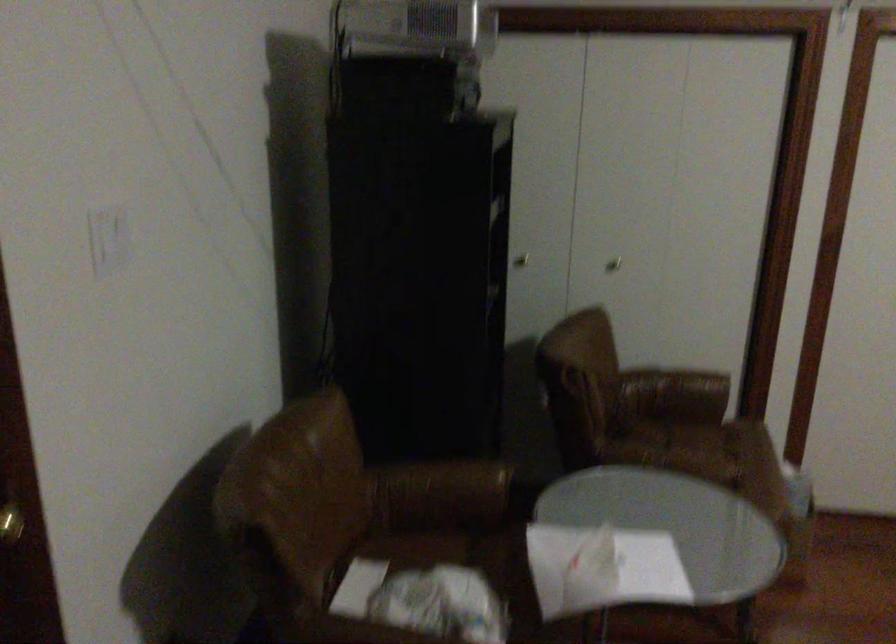
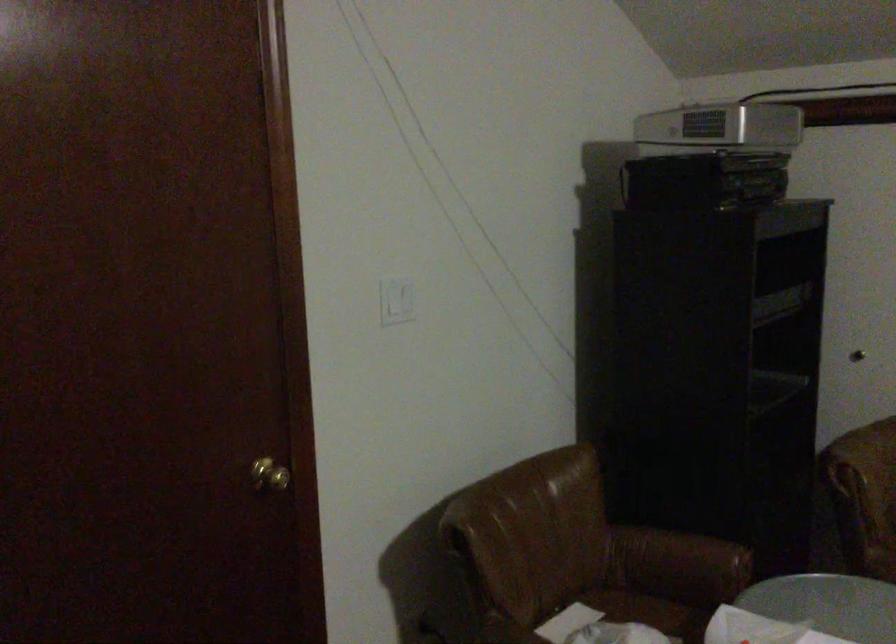
Locate, in the second image, the point that corresponds to (x=446, y=488) in the first image.

(679, 559)